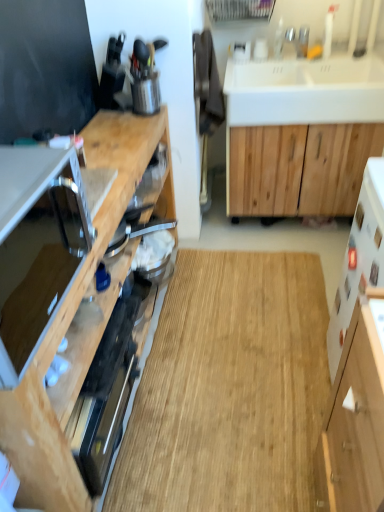
Where is `free space above natural wood floor at center (from a real-world perspective)`? Image resolution: width=384 pixels, height=512 pixels. free space above natural wood floor at center (from a real-world perspective) is located at coordinates (241, 341).